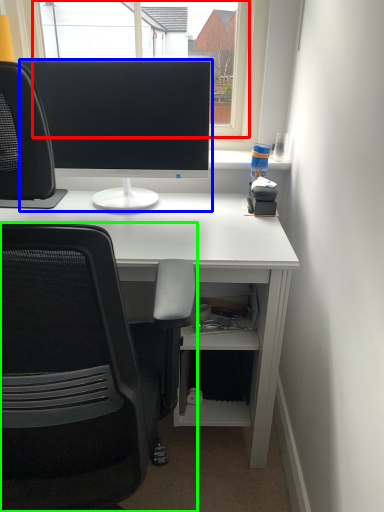
Question: Based on their relative distances, which object is nearer to window screen (highlighted by a red box)? Choose from computer monitor (highlighted by a blue box) and chair (highlighted by a green box).

Choices:
 (A) computer monitor
 (B) chair

Answer: (A)